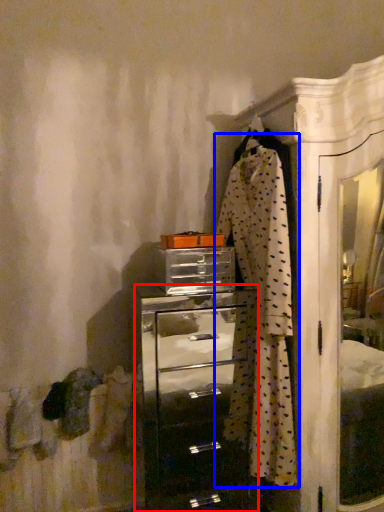
Question: Which point is closer to the camera, chest of drawers (highlighted by a red box) or clothing (highlighted by a blue box)?

Choices:
 (A) chest of drawers
 (B) clothing

Answer: (B)